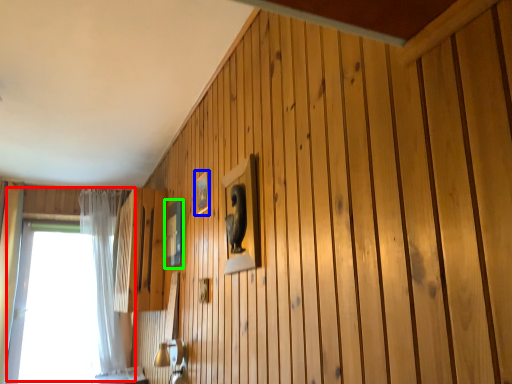
Question: Which object is positioned closest to window (highlighted by a red box)? Select from picture frame (highlighted by a blue box) and picture frame (highlighted by a green box).

Choices:
 (A) picture frame
 (B) picture frame

Answer: (B)